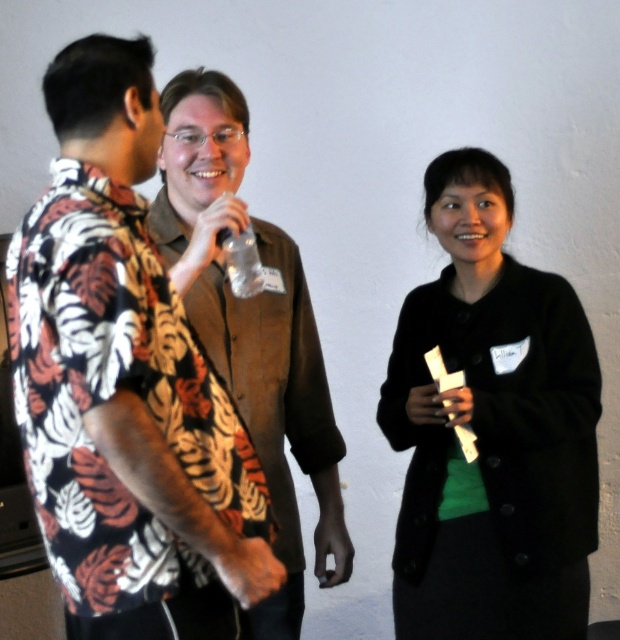
Question: Among these objects, which one is farthest from the camera?

Choices:
 (A) black matte blazer at center
 (B) clear plastic bottle at center
 (C) floral fabric shirt at left

Answer: (A)

Question: Is floral fabric shirt at left to the left of black matte blazer at center from the viewer's perspective?

Choices:
 (A) no
 (B) yes

Answer: (B)

Question: Among these points, which one is farthest from the camera?

Choices:
 (A) (472, 304)
 (B) (118, 595)

Answer: (A)

Question: Is floral fabric shirt at left thinner than brown suede shirt at center?

Choices:
 (A) yes
 (B) no

Answer: (B)

Question: Which object is farther from the camera taking this photo?

Choices:
 (A) brown suede shirt at center
 (B) clear plastic bottle at center
 (C) floral fabric shirt at left
 (D) black matte blazer at center

Answer: (D)

Question: Is floral fabric shirt at left behind black matte blazer at center?

Choices:
 (A) no
 (B) yes

Answer: (A)